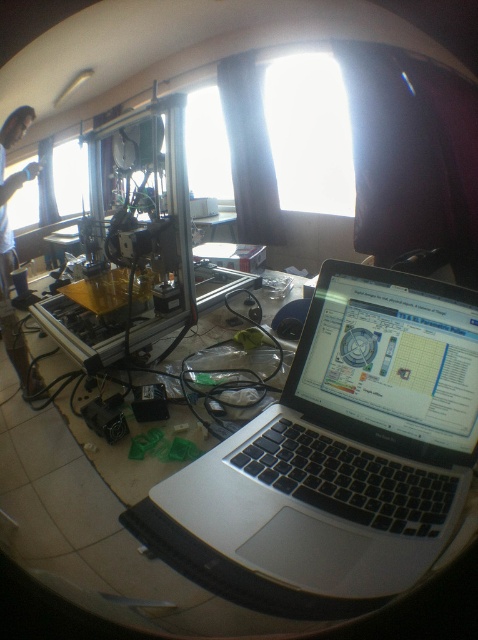
Question: Can you confirm if silver/black keyboard at center is positioned to the left of light brown wood man at left?

Choices:
 (A) no
 (B) yes

Answer: (A)

Question: Does silver/black keyboard at center appear on the right side of light brown wood man at left?

Choices:
 (A) no
 (B) yes

Answer: (B)

Question: Which point is closer to the camera taking this photo?

Choices:
 (A) (32, 115)
 (B) (469, 333)

Answer: (B)

Question: Observing the image, what is the correct spatial positioning of silver/black keyboard at center in reference to light brown wood man at left?

Choices:
 (A) right
 (B) left

Answer: (A)

Question: Which of the following is the closest to the observer?

Choices:
 (A) silver/black keyboard at center
 (B) light brown wood man at left

Answer: (A)